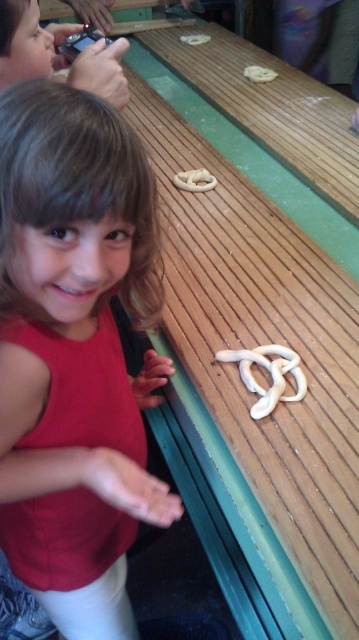
You are standing in front of the fairground table and want to place a new pretzel on the table. The table has two points marked as point 1 at coordinates point [169,129] and point 2 at coordinates point [49,140]. If you want to place the new pretzel between these two points, which point should be closer to the front edge of the table?

Point 2 at coordinates point [49,140] is closer to the front edge of the table because point [169,129] is behind point [49,140].

Where is the wooden picnic table at center located in the image?

The wooden picnic table at center is located at point (258, 344).

You are standing in the fairground and see the wooden picnic table at center and the matte red shirt at center. Which object is closer to you?

The wooden picnic table at center is closer to you than the matte red shirt at center because it is further to the viewer.